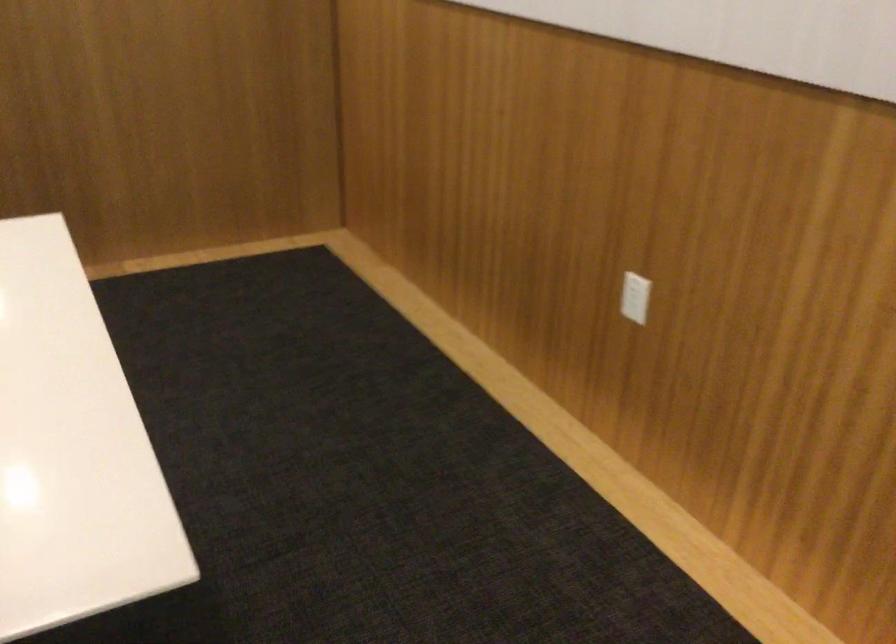
The image size is (896, 644). In order to click on white wall switch in this screenshot , I will do `click(634, 297)`.